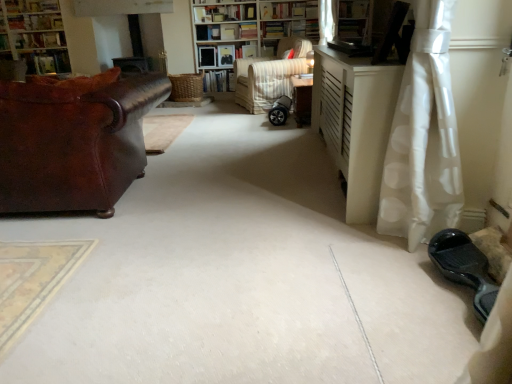
Question: Considering their positions, is wooden bookshelf at center, acting as the second shelf starting from the right, located in front of or behind white dotted fabric at right?

Choices:
 (A) behind
 (B) front

Answer: (A)

Question: Is point (223, 62) closer or farther from the camera than point (446, 97)?

Choices:
 (A) closer
 (B) farther

Answer: (B)

Question: Considering the real-world distances, which object is farthest from the wooden bookshelf at center, which is counted as the 2th shelf, starting from the bottom?

Choices:
 (A) matte black table at center, the first table in the back-to-front sequence
 (B) hardcover book at upper center, placed as the 3th book when sorted from right to left
 (C) brown leather couch at left
 (D) white matte cabinet at right, arranged as the 1th table when viewed from the front
 (E) hardcover book at upper left, which is counted as the 1th book, starting from the left

Answer: (C)

Question: Based on their relative distances, which object is nearer to the hardcover books at upper center, the first book positioned from the right?

Choices:
 (A) brown leather couch at left
 (B) wooden bookshelf at center, placed as the 2th shelf when sorted from front to back
 (C) matte black table at center, the first table in the back-to-front sequence
 (D) white textured bookcase at center, which is the first bookcase in right-to-left order
 (E) wooden bookshelf at upper center, the 1th shelf when ordered from bottom to top

Answer: (D)